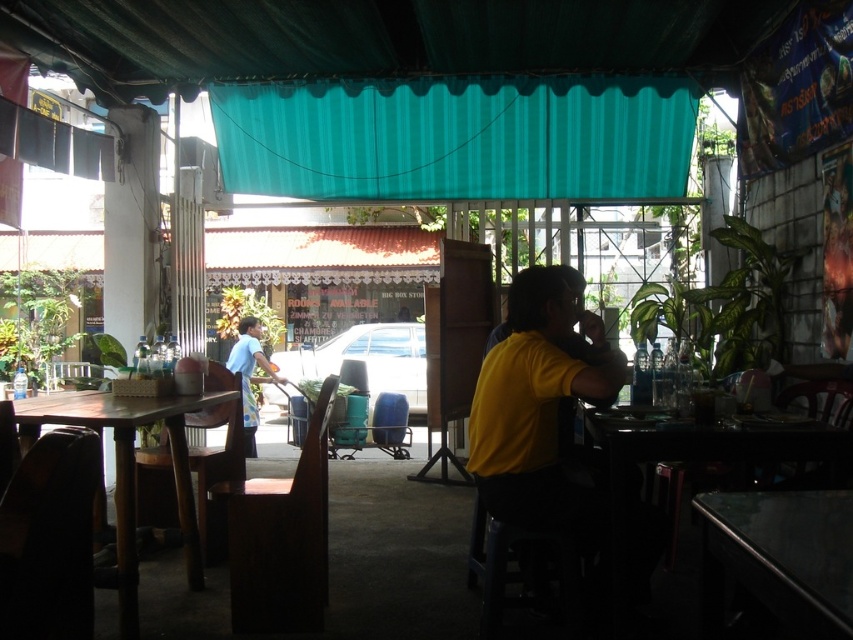
Between wooden chair at lower left and wooden chair at lower right, which one has more height?

With more height is wooden chair at lower right.

Can you confirm if wooden chair at lower left is positioned to the left of wooden chair at lower right?

Yes, wooden chair at lower left is to the left of wooden chair at lower right.

The height and width of the screenshot is (640, 853). I want to click on wooden chair at lower left, so tap(49, 540).

Is shiny black table at lower right below wooden chair at lower left?

Yes, shiny black table at lower right is below wooden chair at lower left.

Is shiny black table at lower right closer to the viewer compared to wooden chair at lower left?

Yes, it is.

This screenshot has width=853, height=640. Describe the element at coordinates (779, 557) in the screenshot. I see `shiny black table at lower right` at that location.

At what (x,y) coordinates should I click in order to perform the action: click on shiny black table at lower right. Please return your answer as a coordinate pair (x, y). This screenshot has height=640, width=853. Looking at the image, I should click on [x=779, y=557].

Who is more distant from viewer, (225, 452) or (827, 406)?

Positioned behind is point (225, 452).

Does point (143, 472) lie behind point (820, 387)?

Yes.

Where is `wooden chair at left`? wooden chair at left is located at coordinates (216, 474).

Where is `wooden chair at left`? wooden chair at left is located at coordinates (216, 474).